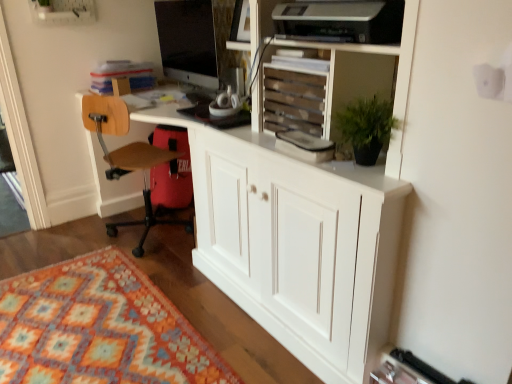
This screenshot has width=512, height=384. Describe the element at coordinates (293, 101) in the screenshot. I see `wooden slats at upper center` at that location.

Find the location of a particular element. brown wood chair at left is located at coordinates (127, 157).

What are the coordinates of `matte black monitor at upper center` in the screenshot? It's located at (188, 41).

The height and width of the screenshot is (384, 512). I want to click on computer monitor located behind the multicolored woven rug at lower left, so point(188,41).

Does point (174, 319) come behind point (166, 23)?

No.

Based on their positions, is multicolored woven rug at lower left located to the left or right of matte black monitor at upper center?

multicolored woven rug at lower left is positioned on matte black monitor at upper center's left side.

Which of these two, multicolored woven rug at lower left or matte black monitor at upper center, is smaller?

With smaller size is multicolored woven rug at lower left.

Which object is more forward, wooden slats at upper center or brown wood chair at left?

wooden slats at upper center is in front.

From the image's perspective, which is below, wooden slats at upper center or brown wood chair at left?

brown wood chair at left is shown below in the image.

From a real-world perspective, who is located lower, wooden slats at upper center or brown wood chair at left?

In real-world perspective, brown wood chair at left is lower.

Which object is thinner, multicolored woven rug at lower left or wooden slats at upper center?

With smaller width is wooden slats at upper center.

Is multicolored woven rug at lower left oriented towards wooden slats at upper center?

No.

Considering the positions of objects multicolored woven rug at lower left and wooden slats at upper center in the image provided, who is behind, multicolored woven rug at lower left or wooden slats at upper center?

wooden slats at upper center.

Is point (269, 95) positioned in front of point (167, 73)?

Yes, point (269, 95) is in front of point (167, 73).

Is wooden slats at upper center further to the viewer compared to matte black monitor at upper center?

No, wooden slats at upper center is closer to the camera.

In terms of width, does wooden slats at upper center look wider or thinner when compared to matte black monitor at upper center?

Clearly, wooden slats at upper center has less width compared to matte black monitor at upper center.

Based on their positions, is wooden slats at upper center located to the left or right of matte black monitor at upper center?

Clearly, wooden slats at upper center is on the right of matte black monitor at upper center in the image.

Does brown wood chair at left have a lesser height compared to multicolored woven rug at lower left?

No, brown wood chair at left is not shorter than multicolored woven rug at lower left.

Is brown wood chair at left at the left side of multicolored woven rug at lower left?

In fact, brown wood chair at left is to the right of multicolored woven rug at lower left.

Between brown wood chair at left and multicolored woven rug at lower left, which one has larger width?

multicolored woven rug at lower left.

Looking at this image, is brown wood chair at left far from multicolored woven rug at lower left?

Actually, brown wood chair at left and multicolored woven rug at lower left are a little close together.

Does point (130, 151) appear closer or farther from the camera than point (274, 86)?

Point (130, 151) appears to be farther away from the viewer than point (274, 86).

In order to click on chair on the left of wooden slats at upper center in this screenshot , I will do `click(127, 157)`.

Is brown wood chair at left positioned in front of wooden slats at upper center?

No, brown wood chair at left is further to the viewer.

From a real-world perspective, is matte black monitor at upper center on wooden slats at upper center?

Yes, from a real-world perspective, matte black monitor at upper center is on top of wooden slats at upper center.

From the image's perspective, would you say matte black monitor at upper center is shown under wooden slats at upper center?

No, from the image's perspective, matte black monitor at upper center is not below wooden slats at upper center.

Is matte black monitor at upper center facing away from wooden slats at upper center?

That's not correct — matte black monitor at upper center is not looking away from wooden slats at upper center.

Locate an element on the screen. The height and width of the screenshot is (384, 512). computer monitor above the multicolored woven rug at lower left (from a real-world perspective) is located at coordinates (188, 41).

Where is `chair behind the wooden slats at upper center`? The image size is (512, 384). chair behind the wooden slats at upper center is located at coordinates (127, 157).

From the image, which object appears to be farther from matte black monitor at upper center, brown wood chair at left or multicolored woven rug at lower left?

multicolored woven rug at lower left is further to matte black monitor at upper center.

Estimate the real-world distances between objects in this image. Which object is closer to matte black monitor at upper center, multicolored woven rug at lower left or wooden slats at upper center?

wooden slats at upper center.

Considering their positions, is wooden slats at upper center positioned further to matte black monitor at upper center than multicolored woven rug at lower left?

The object further to matte black monitor at upper center is multicolored woven rug at lower left.

From the image, which object appears to be nearer to wooden slats at upper center, matte black monitor at upper center or multicolored woven rug at lower left?

matte black monitor at upper center is positioned closer to the anchor wooden slats at upper center.

Consider the image. Looking at the image, which one is located closer to matte black monitor at upper center, multicolored woven rug at lower left or brown wood chair at left?

brown wood chair at left.

Based on the photo, when comparing their distances from wooden slats at upper center, does multicolored woven rug at lower left or matte black monitor at upper center seem closer?

matte black monitor at upper center lies closer to wooden slats at upper center than the other object.

When comparing their distances from wooden slats at upper center, does matte black monitor at upper center or brown wood chair at left seem further?

The object further to wooden slats at upper center is brown wood chair at left.

Considering their positions, is wooden slats at upper center positioned further to multicolored woven rug at lower left than matte black monitor at upper center?

matte black monitor at upper center is further to multicolored woven rug at lower left.

The width and height of the screenshot is (512, 384). Find the location of `drawer between matte black monitor at upper center and multicolored woven rug at lower left vertically`. drawer between matte black monitor at upper center and multicolored woven rug at lower left vertically is located at coordinates (293, 101).

Where is `chair situated between multicolored woven rug at lower left and wooden slats at upper center from left to right`? chair situated between multicolored woven rug at lower left and wooden slats at upper center from left to right is located at coordinates (127, 157).

The image size is (512, 384). In order to click on computer monitor situated between brown wood chair at left and wooden slats at upper center from left to right in this screenshot , I will do `click(188, 41)`.

What are the coordinates of `chair that lies between matte black monitor at upper center and multicolored woven rug at lower left from top to bottom` in the screenshot? It's located at (127, 157).